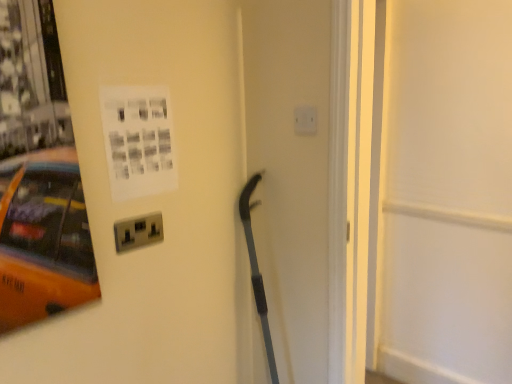
Describe the element at coordinates (138, 232) in the screenshot. The height and width of the screenshot is (384, 512). I see `white plastic electric outlet at center-left, the 2th electric outlet positioned from the right` at that location.

Where is `white plastic electric outlet at upper center, the 1th electric outlet when ordered from back to front`? white plastic electric outlet at upper center, the 1th electric outlet when ordered from back to front is located at coordinates coord(305,120).

What do you see at coordinates (138, 140) in the screenshot? This screenshot has height=384, width=512. I see `white paper at upper left` at bounding box center [138, 140].

Locate an element on the screen. The height and width of the screenshot is (384, 512). white plastic electric outlet at center-left, which is the first electric outlet in bottom-to-top order is located at coordinates click(x=138, y=232).

Consider the image. From the image's perspective, which is above, white plastic electric outlet at upper center, the 1th electric outlet when ordered from back to front, or white paper at upper left?

white plastic electric outlet at upper center, the 1th electric outlet when ordered from back to front, from the image's perspective.

Is white plastic electric outlet at upper center, which appears as the 1th electric outlet when viewed from the right, beside white paper at upper left?

No, white plastic electric outlet at upper center, which appears as the 1th electric outlet when viewed from the right, is not making contact with white paper at upper left.

Considering the relative sizes of white plastic electric outlet at upper center, the second electric outlet in the left-to-right sequence, and white paper at upper left in the image provided, is white plastic electric outlet at upper center, the second electric outlet in the left-to-right sequence, thinner than white paper at upper left?

Incorrect, the width of white plastic electric outlet at upper center, the second electric outlet in the left-to-right sequence, is not less than that of white paper at upper left.

Is white paper at upper left at the back of white plastic electric outlet at upper center, the second electric outlet in the left-to-right sequence?

No, white plastic electric outlet at upper center, the second electric outlet in the left-to-right sequence, is not facing away from white paper at upper left.

In the image, is white matte door at center on the left side or the right side of white paper at upper left?

Based on their positions, white matte door at center is located to the right of white paper at upper left.

Is the position of white matte door at center less distant than that of white paper at upper left?

Yes, white matte door at center is closer to the viewer.

From the image's perspective, which one is positioned lower, white matte door at center or white paper at upper left?

white matte door at center.

You are a GUI agent. You are given a task and a screenshot of the screen. Output one action in this format:
    pyautogui.click(x=<x>, y=<y>)
    Task: Click on the door below the white paper at upper left (from a real-world perspective)
    Image resolution: width=512 pixels, height=384 pixels.
    Given the screenshot: What is the action you would take?
    pyautogui.click(x=442, y=192)

Is white matte door at center far away from white plastic electric outlet at upper center, the second electric outlet in the left-to-right sequence?

That's right, there is a large distance between white matte door at center and white plastic electric outlet at upper center, the second electric outlet in the left-to-right sequence.

Is white matte door at center at the right side of white plastic electric outlet at upper center, the 1th electric outlet when ordered from back to front?

Yes.

Considering the points (441, 283) and (298, 114), which point is in front, point (441, 283) or point (298, 114)?

Positioned in front is point (298, 114).

Where is `electric outlet that is above the white matte door at center (from the image's perspective)`? The image size is (512, 384). electric outlet that is above the white matte door at center (from the image's perspective) is located at coordinates (305, 120).

Does white matte door at center touch white plastic electric outlet at center-left, which is the first electric outlet in bottom-to-top order?

No.

Is white matte door at center outside of white plastic electric outlet at center-left, which is the first electric outlet in bottom-to-top order?

Absolutely, white matte door at center is external to white plastic electric outlet at center-left, which is the first electric outlet in bottom-to-top order.

From a real-world perspective, is white matte door at center located beneath white plastic electric outlet at center-left, the 2th electric outlet positioned from the right?

Correct, in the physical world, white matte door at center is lower than white plastic electric outlet at center-left, the 2th electric outlet positioned from the right.

In the scene shown: What's the angular difference between white plastic electric outlet at center-left, the 2th electric outlet positioned from the right, and white matte door at center's facing directions?

The facing directions of white plastic electric outlet at center-left, the 2th electric outlet positioned from the right, and white matte door at center are 91.9 degrees apart.

Is white plastic electric outlet at center-left, which is the first electric outlet from left to right, shorter than white matte door at center?

Indeed, white plastic electric outlet at center-left, which is the first electric outlet from left to right, has a lesser height compared to white matte door at center.

In the scene shown: From a real-world perspective, is white plastic electric outlet at center-left, which is the first electric outlet from left to right, below white matte door at center?

Actually, white plastic electric outlet at center-left, which is the first electric outlet from left to right, is physically above white matte door at center in the real world.

Considering the sizes of objects white plastic electric outlet at center-left, which is the first electric outlet in bottom-to-top order, and white matte door at center in the image provided, who is wider, white plastic electric outlet at center-left, which is the first electric outlet in bottom-to-top order, or white matte door at center?

Wider between the two is white matte door at center.

Is white plastic electric outlet at center-left, which is the first electric outlet from left to right, thinner than white plastic electric outlet at upper center, the 1th electric outlet when ordered from back to front?

No, white plastic electric outlet at center-left, which is the first electric outlet from left to right, is not thinner than white plastic electric outlet at upper center, the 1th electric outlet when ordered from back to front.

How different are the orientations of white plastic electric outlet at center-left, the second electric outlet when ordered from back to front, and white plastic electric outlet at upper center, which is the second electric outlet from bottom to top, in degrees?

The facing directions of white plastic electric outlet at center-left, the second electric outlet when ordered from back to front, and white plastic electric outlet at upper center, which is the second electric outlet from bottom to top, are 90.1 degrees apart.

Who is more distant, white plastic electric outlet at center-left, which is the first electric outlet from left to right, or white plastic electric outlet at upper center, the 1th electric outlet when ordered from back to front?

white plastic electric outlet at upper center, the 1th electric outlet when ordered from back to front, is further from the camera.

Is white plastic electric outlet at center-left, the 2th electric outlet positioned from the right, inside the boundaries of white plastic electric outlet at upper center, which is the second electric outlet from bottom to top, or outside?

white plastic electric outlet at center-left, the 2th electric outlet positioned from the right, is spatially situated outside white plastic electric outlet at upper center, which is the second electric outlet from bottom to top.

Which of these two, white plastic electric outlet at center-left, placed as the 1th electric outlet when sorted from front to back, or white paper at upper left, is smaller?

With smaller size is white plastic electric outlet at center-left, placed as the 1th electric outlet when sorted from front to back.

In terms of width, does white plastic electric outlet at center-left, which is the 2th electric outlet from top to bottom, look wider or thinner when compared to white paper at upper left?

Considering their sizes, white plastic electric outlet at center-left, which is the 2th electric outlet from top to bottom, looks broader than white paper at upper left.

Does white plastic electric outlet at center-left, which is the 2th electric outlet from top to bottom, contain white paper at upper left?

Definitely not — white paper at upper left is not inside white plastic electric outlet at center-left, which is the 2th electric outlet from top to bottom.

Locate an element on the screen. This screenshot has width=512, height=384. electric outlet on the right side of white paper at upper left is located at coordinates (305, 120).

Image resolution: width=512 pixels, height=384 pixels. I want to click on poster page located above the white matte door at center (from a real-world perspective), so click(138, 140).

When comparing their distances from white matte door at center, does white plastic electric outlet at upper center, which appears as the 1th electric outlet when viewed from the right, or white plastic electric outlet at center-left, placed as the 1th electric outlet when sorted from front to back, seem further?

white plastic electric outlet at center-left, placed as the 1th electric outlet when sorted from front to back.

Based on their spatial positions, is white paper at upper left or white plastic electric outlet at upper center, the second electric outlet in the left-to-right sequence, further from white plastic electric outlet at center-left, which is the first electric outlet from left to right?

Among the two, white plastic electric outlet at upper center, the second electric outlet in the left-to-right sequence, is located further to white plastic electric outlet at center-left, which is the first electric outlet from left to right.

Which object lies nearer to the anchor point white plastic electric outlet at center-left, placed as the 1th electric outlet when sorted from front to back, white matte door at center or white paper at upper left?

white paper at upper left is positioned closer to the anchor white plastic electric outlet at center-left, placed as the 1th electric outlet when sorted from front to back.

Looking at the image, which one is located further to white plastic electric outlet at center-left, the second electric outlet when ordered from back to front, white matte door at center or white plastic electric outlet at upper center, which appears as the 1th electric outlet when viewed from the right?

Among the two, white matte door at center is located further to white plastic electric outlet at center-left, the second electric outlet when ordered from back to front.

Which object lies further to the anchor point white paper at upper left, white plastic electric outlet at center-left, the second electric outlet when ordered from back to front, or white plastic electric outlet at upper center, which appears as the 1th electric outlet when viewed from the right?

Based on the image, white plastic electric outlet at upper center, which appears as the 1th electric outlet when viewed from the right, appears to be further to white paper at upper left.

From the picture: Considering their positions, is white plastic electric outlet at center-left, the second electric outlet when ordered from back to front, positioned closer to white plastic electric outlet at upper center, which appears as the 1th electric outlet when viewed from the right, than white paper at upper left?

white paper at upper left is closer to white plastic electric outlet at upper center, which appears as the 1th electric outlet when viewed from the right.

When comparing their distances from white matte door at center, does white plastic electric outlet at center-left, which is the first electric outlet in bottom-to-top order, or white plastic electric outlet at upper center, which appears as the 1th electric outlet when viewed from the right, seem closer?

white plastic electric outlet at upper center, which appears as the 1th electric outlet when viewed from the right, is positioned closer to the anchor white matte door at center.

Looking at the image, which one is located further to white paper at upper left, white matte door at center or white plastic electric outlet at center-left, the 2th electric outlet positioned from the right?

Among the two, white matte door at center is located further to white paper at upper left.

Find the location of a particular element. poster page situated between white plastic electric outlet at center-left, the second electric outlet when ordered from back to front, and white matte door at center from left to right is located at coordinates (138, 140).

Where is `poster page between white plastic electric outlet at center-left, the second electric outlet when ordered from back to front, and white plastic electric outlet at upper center, the second electric outlet in the left-to-right sequence`? The width and height of the screenshot is (512, 384). poster page between white plastic electric outlet at center-left, the second electric outlet when ordered from back to front, and white plastic electric outlet at upper center, the second electric outlet in the left-to-right sequence is located at coordinates (138, 140).

At what (x,y) coordinates should I click in order to perform the action: click on electric outlet between white plastic electric outlet at center-left, which is the first electric outlet from left to right, and white matte door at center from left to right. Please return your answer as a coordinate pair (x, y). The height and width of the screenshot is (384, 512). Looking at the image, I should click on (305, 120).

At what (x,y) coordinates should I click in order to perform the action: click on electric outlet situated between white paper at upper left and white matte door at center from left to right. Please return your answer as a coordinate pair (x, y). This screenshot has height=384, width=512. Looking at the image, I should click on (305, 120).